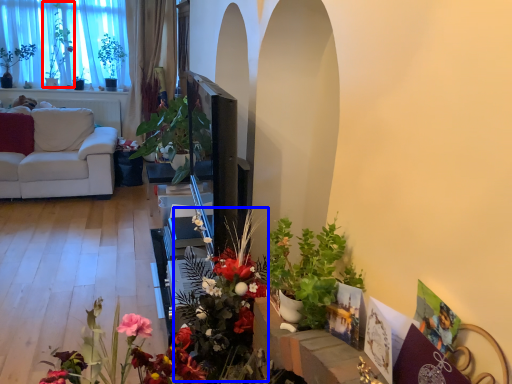
Question: Which of the following is the farthest to the observer, bouquet (highlighted by a red box) or floral arrangement (highlighted by a blue box)?

Choices:
 (A) bouquet
 (B) floral arrangement

Answer: (A)